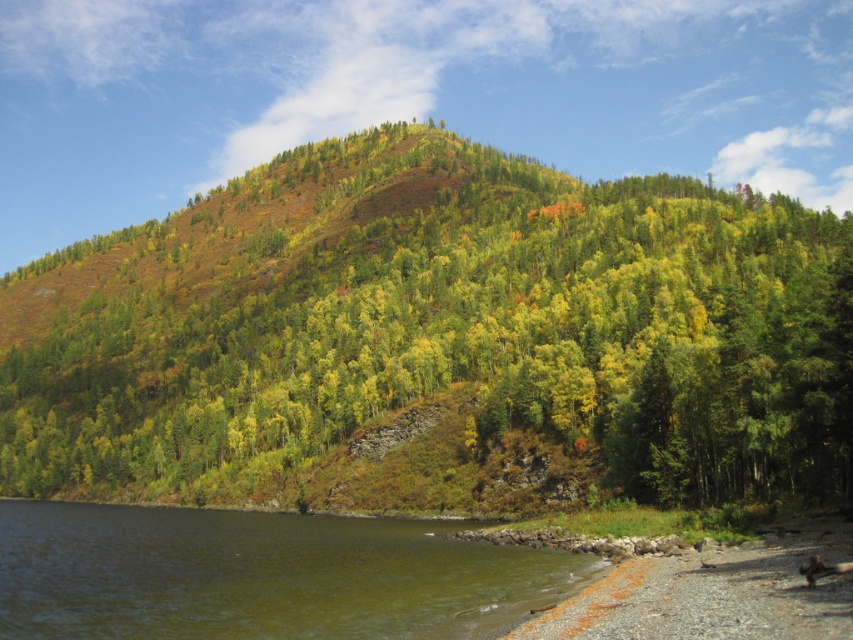
Describe the element at coordinates (436, 339) in the screenshot. I see `green leafy trees at center` at that location.

Between point (793, 337) and point (512, 604), which one is positioned in front?

Point (512, 604)

Image resolution: width=853 pixels, height=640 pixels. In order to click on green leafy trees at center in this screenshot , I will do `click(436, 339)`.

What are the coordinates of `green leafy trees at center` in the screenshot? It's located at (436, 339).